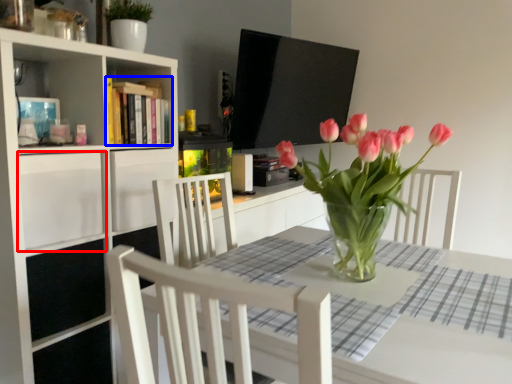
Question: Which point is closer to the camera, drawer (highlighted by a red box) or book (highlighted by a blue box)?

Choices:
 (A) drawer
 (B) book

Answer: (A)